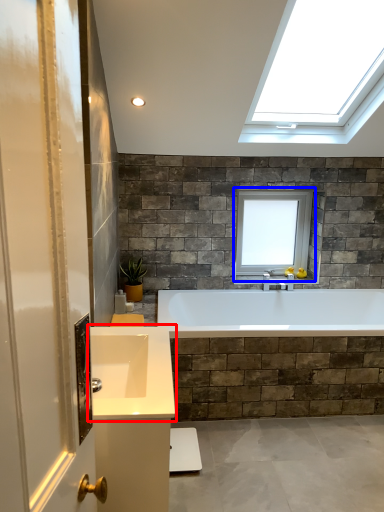
Question: Among these objects, which one is farthest to the camera, sink (highlighted by a red box) or window (highlighted by a blue box)?

Choices:
 (A) sink
 (B) window

Answer: (B)